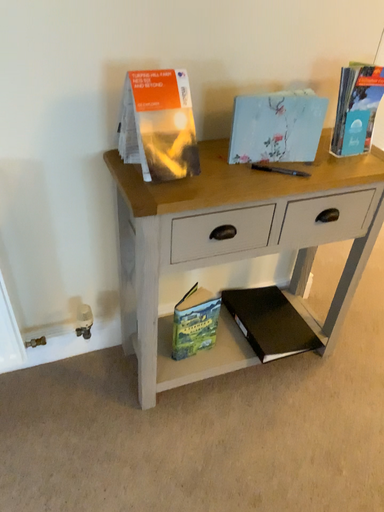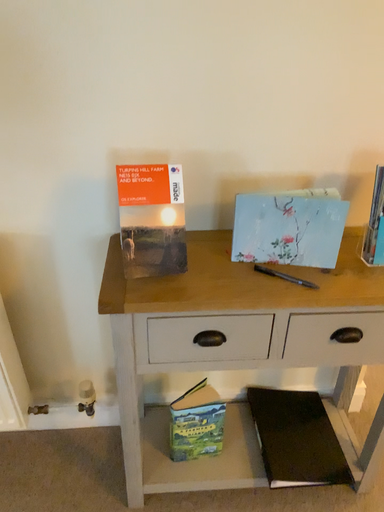
Question: Which way did the camera rotate in the video?

Choices:
 (A) rotated downward
 (B) rotated upward

Answer: (B)